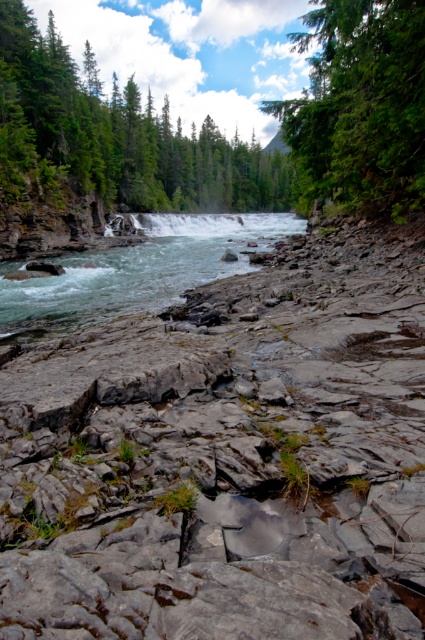
You are standing at the point with coordinates point [289,99] and want to walk to the point with coordinates point [218,307]. Based on the scene description, will you have to cross the riverbed or the flowing river?

Since point [218,307] is in front of point [289,99], you will have to cross the flowing river in the midground to reach it.

You are standing at the point closer to the riverbank and want to walk towards the river. Which point, point (170, 353) or point (231, 218), is closer to the river?

Point (170, 353) is in front of point (231, 218), so it is closer to the river.